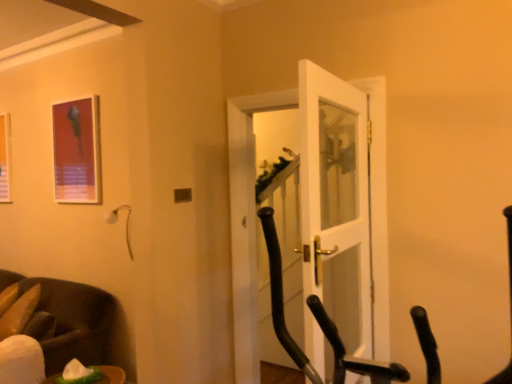
Question: Is metallic frame at upper left, which is counted as the second picture frame, starting from the back, touching dark brown leather chair at lower left?

Choices:
 (A) yes
 (B) no

Answer: (B)

Question: Is metallic frame at upper left, which is counted as the second picture frame, starting from the back, in front of dark brown leather chair at lower left?

Choices:
 (A) yes
 (B) no

Answer: (B)

Question: From the image's perspective, does metallic frame at upper left, which ranks as the first picture frame in right-to-left order, appear lower than dark brown leather chair at lower left?

Choices:
 (A) no
 (B) yes

Answer: (A)

Question: From the image's perspective, is metallic frame at upper left, arranged as the first picture frame when viewed from the front, located above dark brown leather chair at lower left?

Choices:
 (A) no
 (B) yes

Answer: (B)

Question: Can you confirm if metallic frame at upper left, arranged as the first picture frame when viewed from the front, is thinner than dark brown leather chair at lower left?

Choices:
 (A) no
 (B) yes

Answer: (B)

Question: Considering the positions of matte plastic picture frame at upper left, the 1th picture frame in the left-to-right sequence, and white glossy door at center in the image, is matte plastic picture frame at upper left, the 1th picture frame in the left-to-right sequence, wider or thinner than white glossy door at center?

Choices:
 (A) wide
 (B) thin

Answer: (B)

Question: Is matte plastic picture frame at upper left, acting as the first picture frame starting from the back, situated inside white glossy door at center or outside?

Choices:
 (A) outside
 (B) inside

Answer: (A)

Question: Based on their positions, is matte plastic picture frame at upper left, the 1th picture frame in the left-to-right sequence, located to the left or right of white glossy door at center?

Choices:
 (A) right
 (B) left

Answer: (B)

Question: Based on their sizes in the image, would you say matte plastic picture frame at upper left, acting as the first picture frame starting from the back, is bigger or smaller than white glossy door at center?

Choices:
 (A) big
 (B) small

Answer: (B)

Question: From a real-world perspective, is black rubber exercise bike at center positioned above or below metallic frame at upper left, which is counted as the second picture frame, starting from the back?

Choices:
 (A) below
 (B) above

Answer: (A)

Question: Considering their positions, is black rubber exercise bike at center located in front of or behind metallic frame at upper left, placed as the second picture frame when sorted from left to right?

Choices:
 (A) behind
 (B) front

Answer: (B)

Question: Is black rubber exercise bike at center wider or thinner than metallic frame at upper left, placed as the second picture frame when sorted from left to right?

Choices:
 (A) thin
 (B) wide

Answer: (B)

Question: Choose the correct answer: Is black rubber exercise bike at center inside metallic frame at upper left, which ranks as the first picture frame in right-to-left order, or outside it?

Choices:
 (A) outside
 (B) inside

Answer: (A)

Question: Is point (8, 140) positioned closer to the camera than point (57, 139)?

Choices:
 (A) farther
 (B) closer

Answer: (A)

Question: Looking at their shapes, would you say matte plastic picture frame at upper left, placed as the 2th picture frame when sorted from right to left, is wider or thinner than metallic frame at upper left, placed as the second picture frame when sorted from left to right?

Choices:
 (A) thin
 (B) wide

Answer: (A)